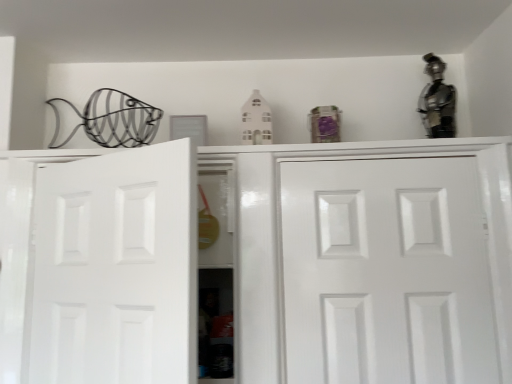
At what (x,y) coordinates should I click in order to perform the action: click on vacant point above white glossy door at center, the 1th door when ordered from right to left (from a real-world perspective). Please return your answer as a coordinate pair (x, y). Looking at the image, I should click on (367, 153).